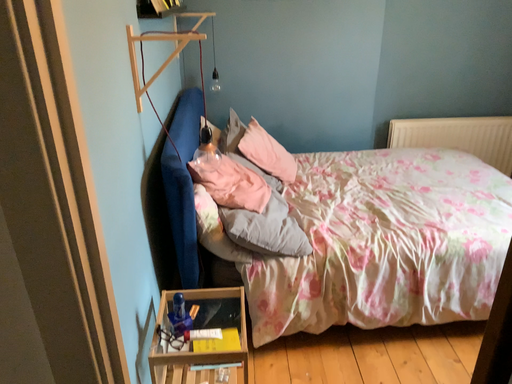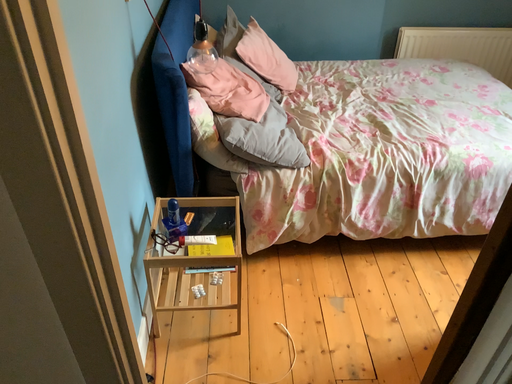
Question: How did the camera likely rotate when shooting the video?

Choices:
 (A) rotated downward
 (B) rotated upward

Answer: (A)